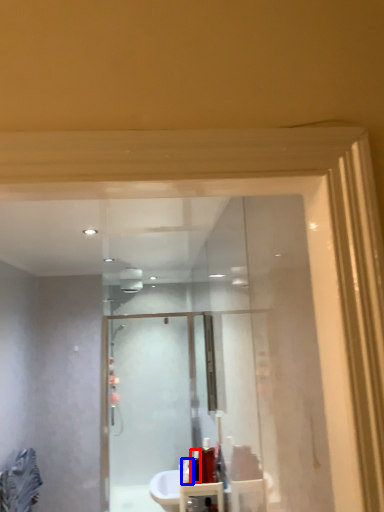
Question: Which object is further to the camera taking this photo, toiletry (highlighted by a red box) or toiletry (highlighted by a blue box)?

Choices:
 (A) toiletry
 (B) toiletry

Answer: (B)